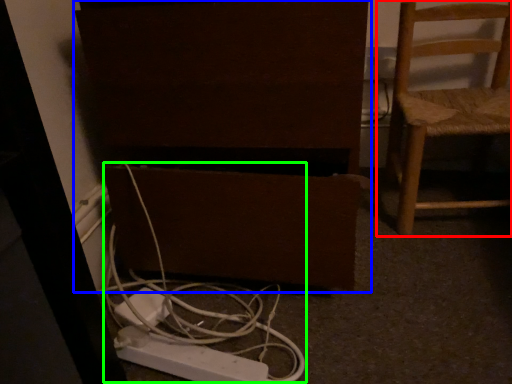
Question: Which is nearer to the chair (highlighted by a red box)? furniture (highlighted by a blue box) or cable (highlighted by a green box).

Choices:
 (A) furniture
 (B) cable

Answer: (A)